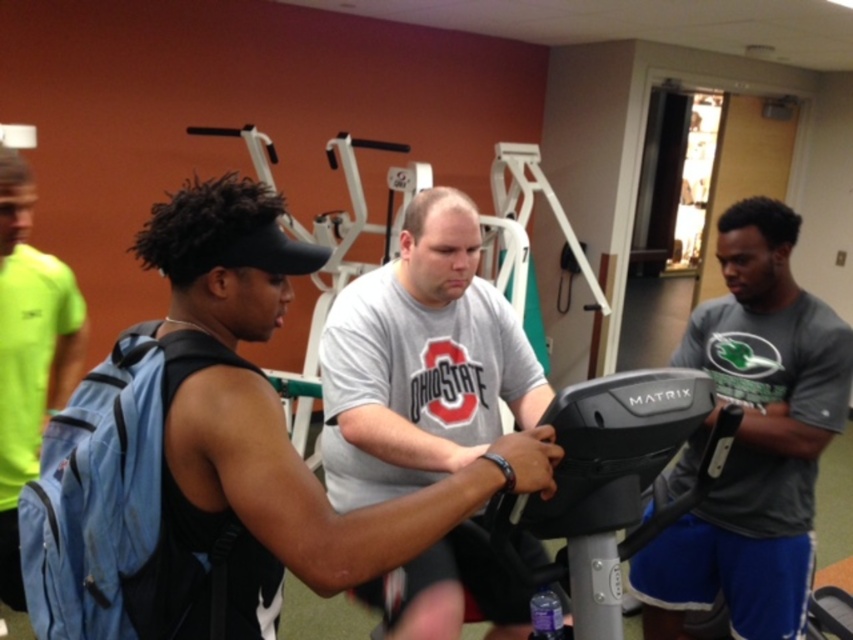
Question: Can you confirm if black matte tank top at center is smaller than gray cotton t-shirt at center?

Choices:
 (A) no
 (B) yes

Answer: (B)

Question: Which object is positioned farthest from the gray cotton t-shirt at center?

Choices:
 (A) denim backpack at left
 (B) black matte tank top at center
 (C) black plastic exercise bike at center

Answer: (A)

Question: Which object is positioned farthest from the gray cotton t-shirt at center?

Choices:
 (A) denim backpack at left
 (B) black matte tank top at center
 (C) gray matte shirt at center
 (D) black plastic exercise bike at center

Answer: (A)

Question: Does gray cotton t-shirt at center have a smaller size compared to denim backpack at left?

Choices:
 (A) yes
 (B) no

Answer: (B)

Question: Does gray matte shirt at center have a greater width compared to black plastic exercise bike at center?

Choices:
 (A) no
 (B) yes

Answer: (A)

Question: Which object is closer to the camera taking this photo?

Choices:
 (A) black plastic exercise bike at center
 (B) gray cotton t-shirt at center
 (C) black matte tank top at center
 (D) denim backpack at left

Answer: (C)